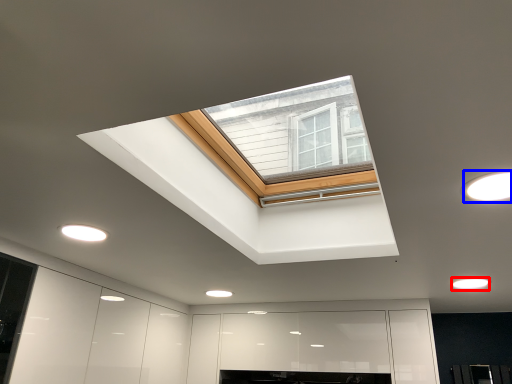
Question: Which object is closer to the camera taking this photo, lighting (highlighted by a red box) or lighting (highlighted by a blue box)?

Choices:
 (A) lighting
 (B) lighting

Answer: (B)